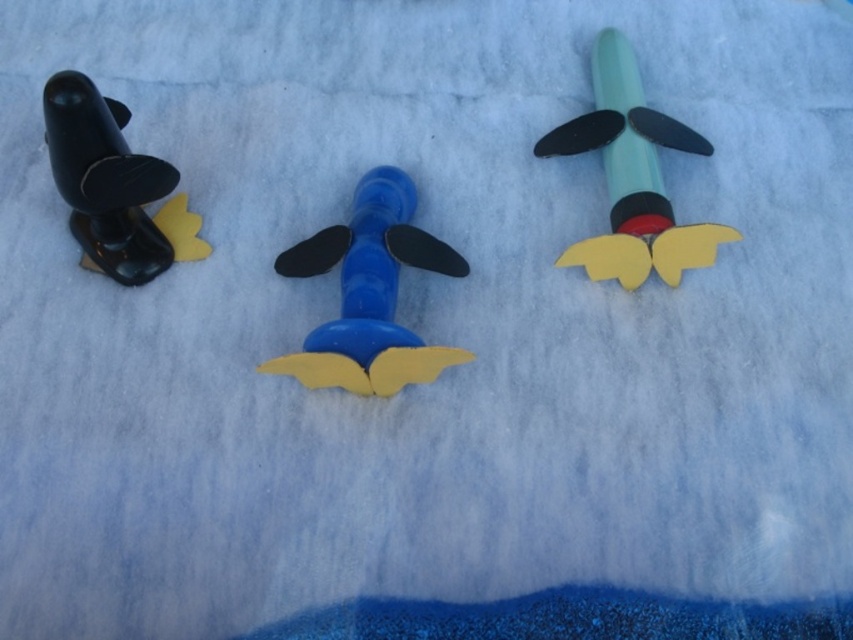
You are a child trying to arrange your toys. You have a blue matte airplane at center and a matte black rocket at left. If you want to place a new toy between them, where should you put it?

You should place the new toy between the blue matte airplane at center and the matte black rocket at left, to the right of the matte black rocket at left and to the left of the blue matte airplane at center.

You are a child trying to stack the matte green rocket at upper right and the matte black rocket at left on top of each other. Which rocket should you place at the bottom to ensure stability?

The matte green rocket at upper right is taller than the matte black rocket at left, so placing the taller matte green rocket at upper right at the bottom would provide a more stable base for stacking.